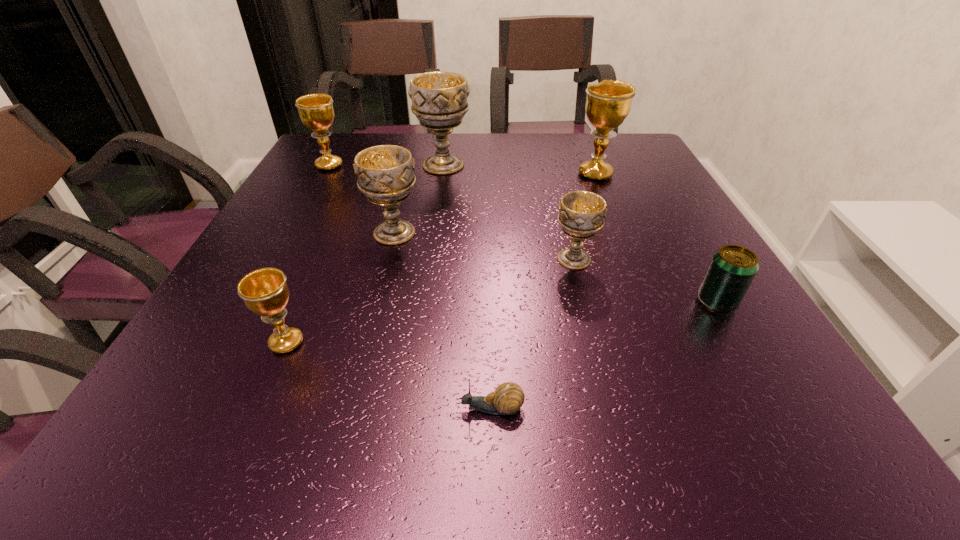
You are a GUI agent. You are given a task and a screenshot of the screen. Output one action in this format:
    pyautogui.click(x=<x>, y=<y>)
    Task: Click on the vacant space located 0.070m on the back of the beer can
    The image size is (960, 540).
    Given the screenshot: What is the action you would take?
    pyautogui.click(x=696, y=265)

Where is `free location located 0.110m on the front-facing side of the shortest object`? free location located 0.110m on the front-facing side of the shortest object is located at coordinates (380, 409).

Where is `vacant region located on the front-facing side of the shortest object`? This screenshot has height=540, width=960. vacant region located on the front-facing side of the shortest object is located at coordinates (346, 409).

The width and height of the screenshot is (960, 540). I want to click on free region located 0.110m on the front-facing side of the shortest object, so click(x=380, y=409).

Locate an element on the screen. object present at the near edge is located at coordinates (507, 399).

Identify the location of chalice located at the right edge. The width and height of the screenshot is (960, 540). (608, 103).

Where is `beer can present at the right edge`? Image resolution: width=960 pixels, height=540 pixels. beer can present at the right edge is located at coordinates pos(732,269).

Image resolution: width=960 pixels, height=540 pixels. In order to click on object positioned at the far left corner in this screenshot , I will do `click(316, 111)`.

At what (x,y) coordinates should I click in order to perform the action: click on object positioned at the far right corner. Please return your answer as a coordinate pair (x, y). The height and width of the screenshot is (540, 960). Looking at the image, I should click on (608, 103).

I want to click on blank space at the far edge of the desktop, so click(x=472, y=164).